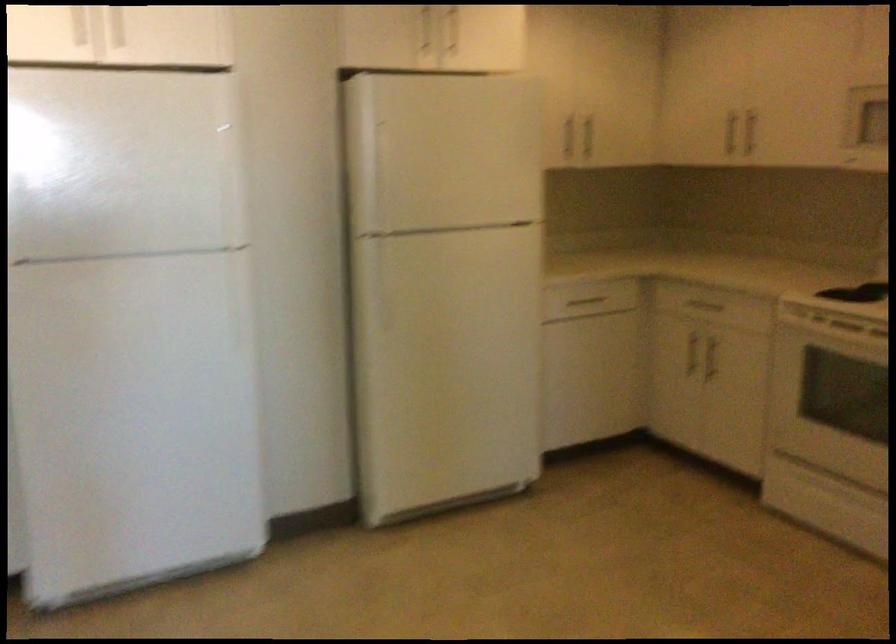
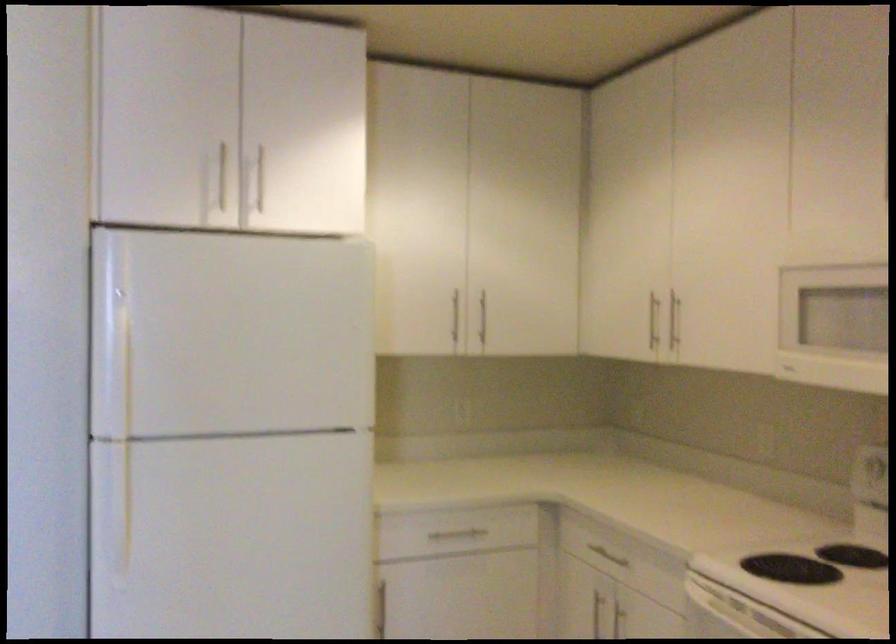
In the second image, find the point that corresponds to pixel 728 129 in the first image.

(652, 321)